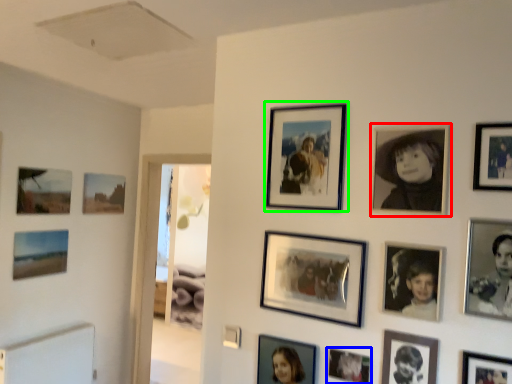
Question: Which is farther away from picture frame (highlighted by a red box)? picture frame (highlighted by a blue box) or picture frame (highlighted by a green box)?

Choices:
 (A) picture frame
 (B) picture frame

Answer: (A)